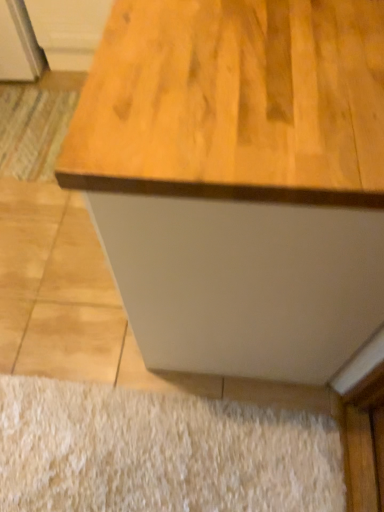
Question: Considering the relative positions of striped fabric doormat at lower left, marked as the 1th doormat in a back-to-front arrangement, and white shaggy rug at lower center, arranged as the 1th doormat when ordered from the bottom, in the image provided, is striped fabric doormat at lower left, marked as the 1th doormat in a back-to-front arrangement, to the left of white shaggy rug at lower center, arranged as the 1th doormat when ordered from the bottom, from the viewer's perspective?

Choices:
 (A) no
 (B) yes

Answer: (B)

Question: Is white shaggy rug at lower center, arranged as the second doormat when viewed from the left, completely or partially inside striped fabric doormat at lower left, placed as the second doormat when sorted from bottom to top?

Choices:
 (A) yes
 (B) no

Answer: (B)

Question: Is striped fabric doormat at lower left, arranged as the 2th doormat when viewed from the right, facing towards white shaggy rug at lower center, which is the second doormat from back to front?

Choices:
 (A) no
 (B) yes

Answer: (A)

Question: Can you confirm if striped fabric doormat at lower left, placed as the second doormat when sorted from bottom to top, is wider than white shaggy rug at lower center, which is the 2th doormat in top-to-bottom order?

Choices:
 (A) no
 (B) yes

Answer: (B)

Question: Is striped fabric doormat at lower left, acting as the second doormat starting from the front, facing away from white shaggy rug at lower center, which is the 2th doormat in top-to-bottom order?

Choices:
 (A) yes
 (B) no

Answer: (B)

Question: Is striped fabric doormat at lower left, which ranks as the first doormat in left-to-right order, at the right side of white shaggy rug at lower center, arranged as the second doormat when viewed from the left?

Choices:
 (A) yes
 (B) no

Answer: (B)

Question: Is white shaggy rug at lower center, arranged as the second doormat when viewed from the left, positioned with its back to striped fabric doormat at lower left, which ranks as the first doormat in left-to-right order?

Choices:
 (A) yes
 (B) no

Answer: (B)

Question: Considering the relative sizes of white shaggy rug at lower center, arranged as the 1th doormat when ordered from the bottom, and striped fabric doormat at lower left, placed as the second doormat when sorted from bottom to top, in the image provided, is white shaggy rug at lower center, arranged as the 1th doormat when ordered from the bottom, taller than striped fabric doormat at lower left, placed as the second doormat when sorted from bottom to top,?

Choices:
 (A) no
 (B) yes

Answer: (B)

Question: Is white shaggy rug at lower center, arranged as the 1th doormat when viewed from the front, at the left side of striped fabric doormat at lower left, which ranks as the first doormat in left-to-right order?

Choices:
 (A) yes
 (B) no

Answer: (B)

Question: Considering the relative positions of white shaggy rug at lower center, which is the 2th doormat in top-to-bottom order, and striped fabric doormat at lower left, which ranks as the first doormat in left-to-right order, in the image provided, is white shaggy rug at lower center, which is the 2th doormat in top-to-bottom order, to the right of striped fabric doormat at lower left, which ranks as the first doormat in left-to-right order, from the viewer's perspective?

Choices:
 (A) yes
 (B) no

Answer: (A)

Question: Does white shaggy rug at lower center, acting as the first doormat starting from the right, have a lesser height compared to striped fabric doormat at lower left, marked as the 1th doormat in a back-to-front arrangement?

Choices:
 (A) no
 (B) yes

Answer: (A)

Question: Is white shaggy rug at lower center, arranged as the 1th doormat when viewed from the front, smaller than striped fabric doormat at lower left, acting as the second doormat starting from the front?

Choices:
 (A) no
 (B) yes

Answer: (A)

Question: From a real-world perspective, is wooden cabinet at upper left over white shaggy rug at lower center, arranged as the 1th doormat when viewed from the front?

Choices:
 (A) no
 (B) yes

Answer: (B)